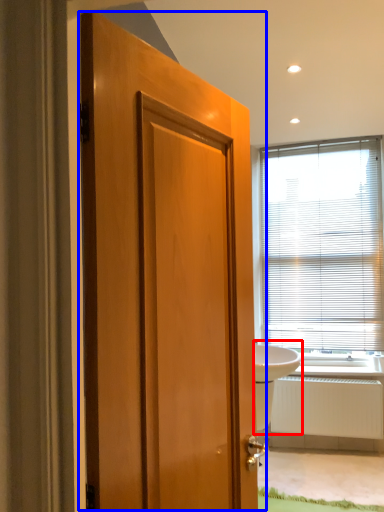
Question: Among these objects, which one is nearest to the camera, sink (highlighted by a red box) or door (highlighted by a blue box)?

Choices:
 (A) sink
 (B) door

Answer: (B)